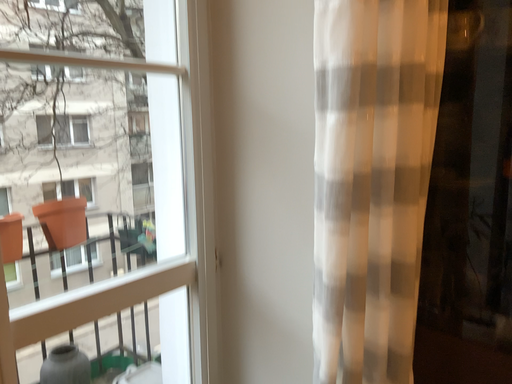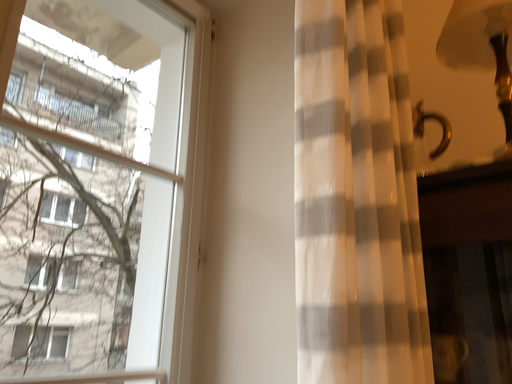
Question: Which way did the camera rotate in the video?

Choices:
 (A) rotated downward
 (B) rotated upward

Answer: (B)